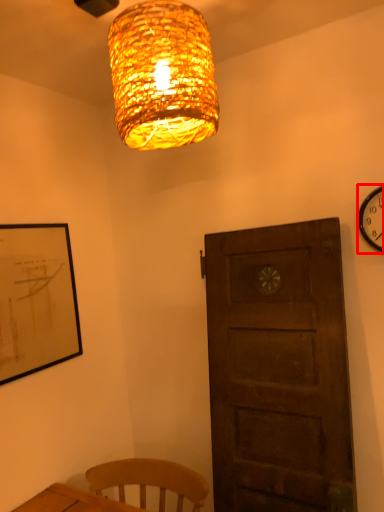
Question: From the image's perspective, considering the relative positions of wall clock (annotated by the red box) and lamp in the image provided, where is wall clock (annotated by the red box) located with respect to the staircase?

Choices:
 (A) below
 (B) above

Answer: (A)